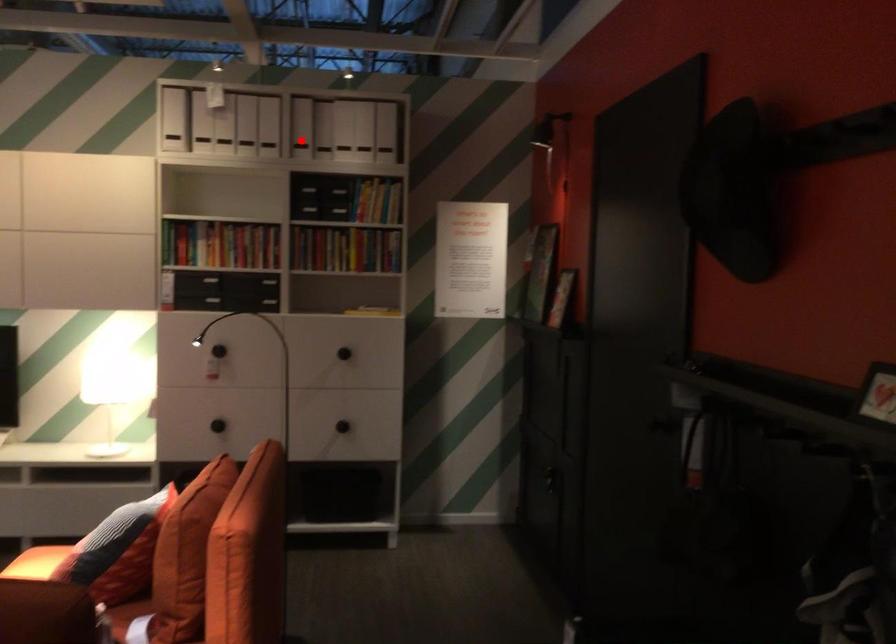
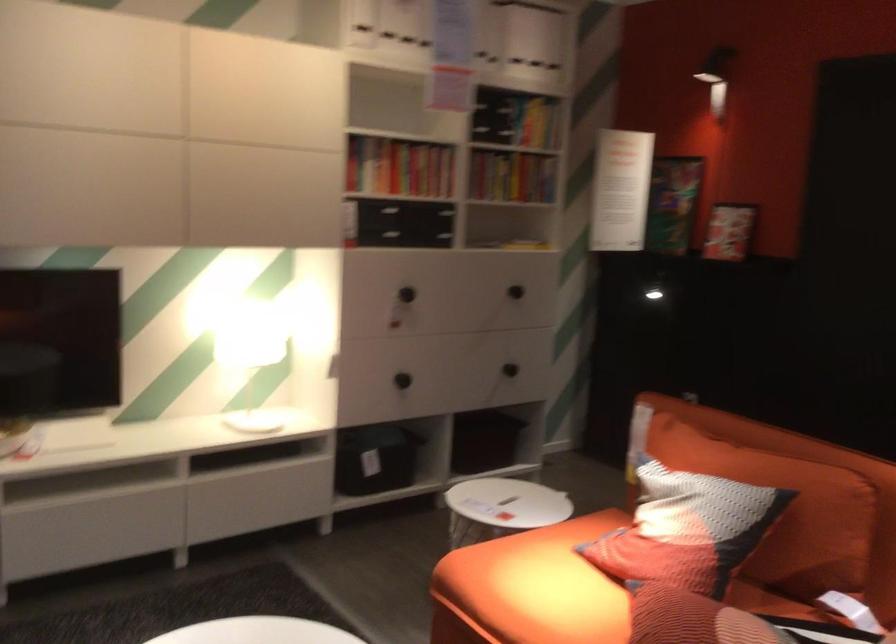
The point at the highlighted location is marked in the first image. Where is the corresponding point in the second image?

(494, 39)